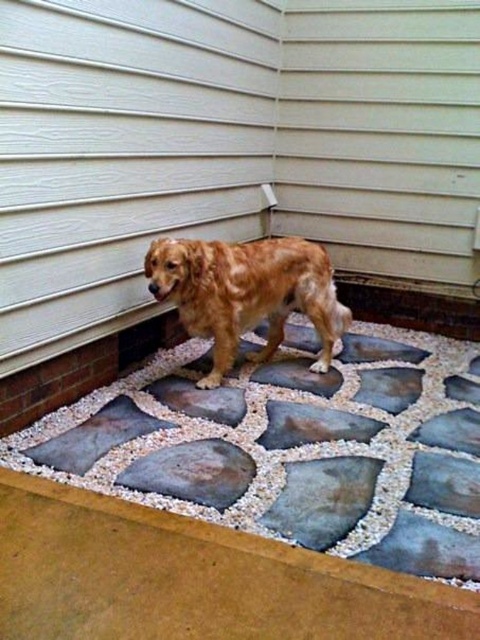
Is white siding at upper left shorter than golden fur dog at center?

No, white siding at upper left is not shorter than golden fur dog at center.

Which is more to the left, white siding at upper left or golden fur dog at center?

Positioned to the left is white siding at upper left.

Locate an element on the screen. The width and height of the screenshot is (480, 640). white siding at upper left is located at coordinates (228, 147).